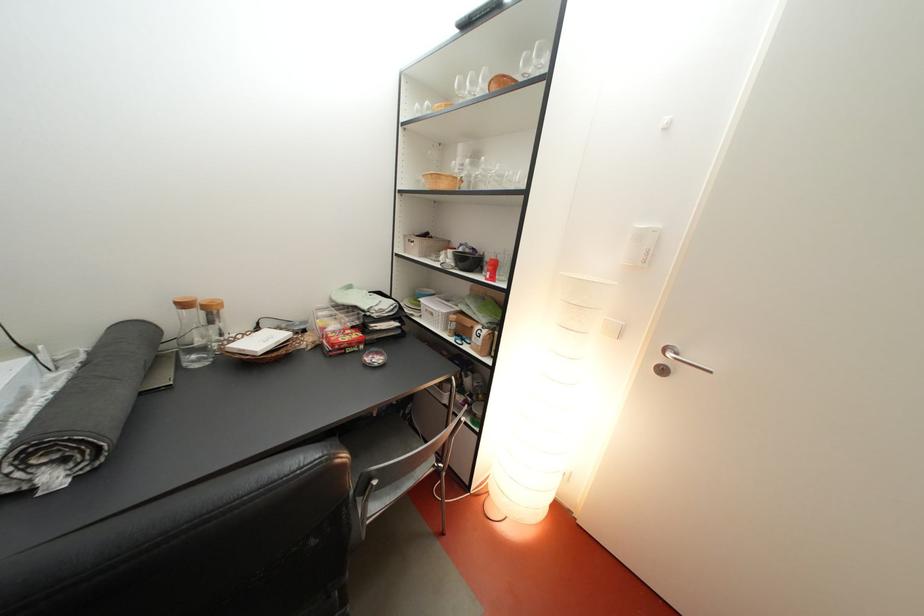
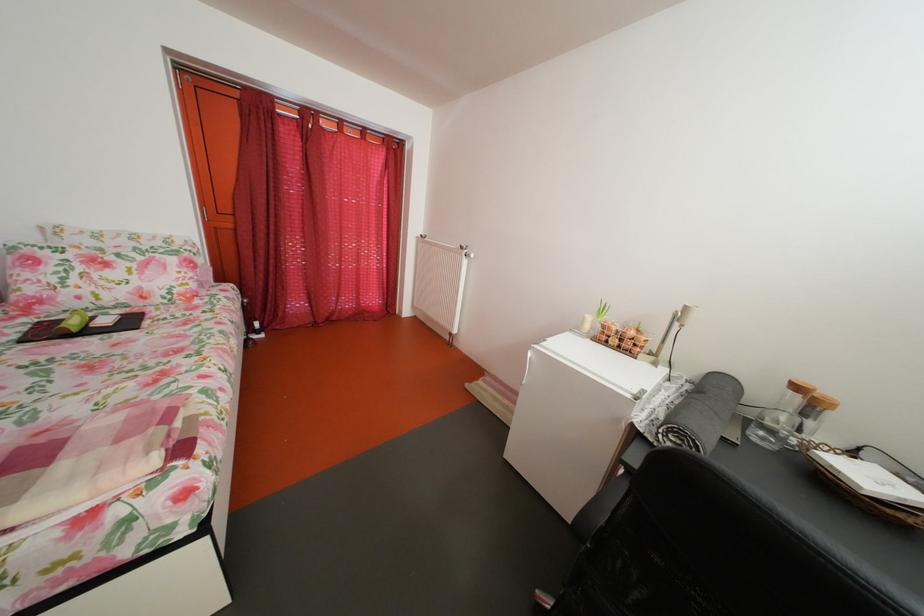
In the second image, find the point that corresponds to (223,318) in the first image.

(824, 411)